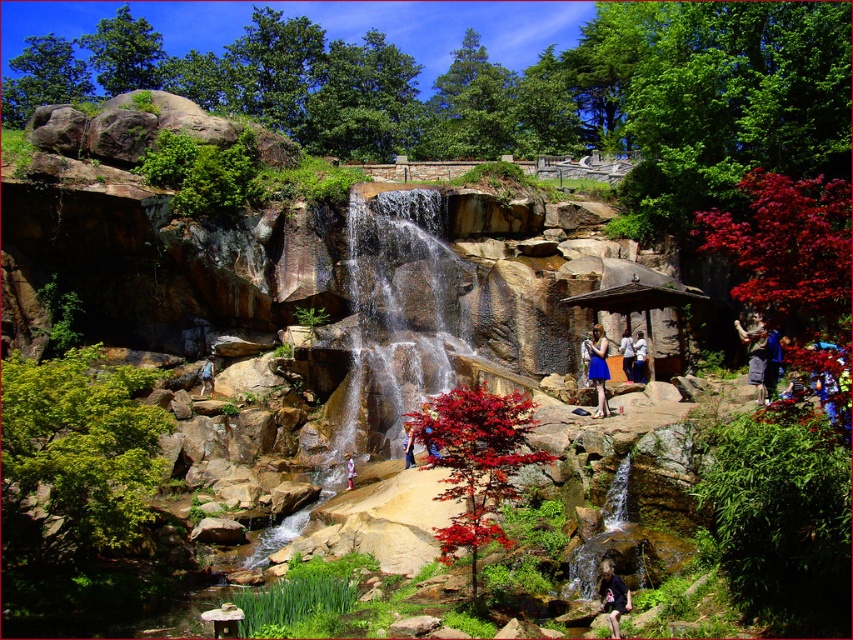
What do you see at coordinates (598, 368) in the screenshot?
I see `blue satin dress at center` at bounding box center [598, 368].

Which of these two, blue satin dress at center or light brown fabric backpack at left, stands taller?

blue satin dress at center is taller.

This screenshot has width=853, height=640. What are the coordinates of `blue satin dress at center` in the screenshot? It's located at (598, 368).

Consider the image. Is blue satin dress at center above pink fabric dress at center?

Correct, blue satin dress at center is located above pink fabric dress at center.

Is blue satin dress at center to the left of pink fabric dress at center from the viewer's perspective?

No, blue satin dress at center is not to the left of pink fabric dress at center.

Is point (601, 394) farther from camera compared to point (347, 470)?

No, it is not.

Find the location of `blue satin dress at center`. blue satin dress at center is located at coordinates (598, 368).

Is point (625, 349) more distant than point (405, 465)?

Yes, it is behind point (405, 465).

Is white cotton shirt at center smaller than blue denim shorts at center?

Incorrect, white cotton shirt at center is not smaller in size than blue denim shorts at center.

Which is in front, point (625, 362) or point (410, 456)?

Point (410, 456) is in front.

Identify the location of white cotton shirt at center. [627, 355].